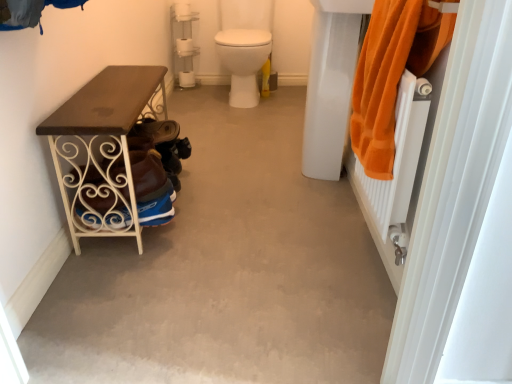
Question: In the image, is white glossy toilet at center positioned in front of or behind white glossy sink at upper right?

Choices:
 (A) front
 (B) behind

Answer: (B)

Question: Is white glossy toilet at center to the left or to the right of white glossy sink at upper right in the image?

Choices:
 (A) right
 (B) left

Answer: (B)

Question: Based on their relative distances, which object is nearer to the brown wood table at left?

Choices:
 (A) orange terry cloth towel at right
 (B) white glossy toilet at center
 (C) smooth concrete floor at center
 (D) white glossy sink at upper right
 (E) brown suede shoe at lower left

Answer: (E)

Question: Considering the real-world distances, which object is closest to the brown suede shoe at lower left?

Choices:
 (A) white glossy toilet at center
 (B) brown wood table at left
 (C) orange terry cloth towel at right
 (D) smooth concrete floor at center
 (E) white glossy sink at upper right

Answer: (B)